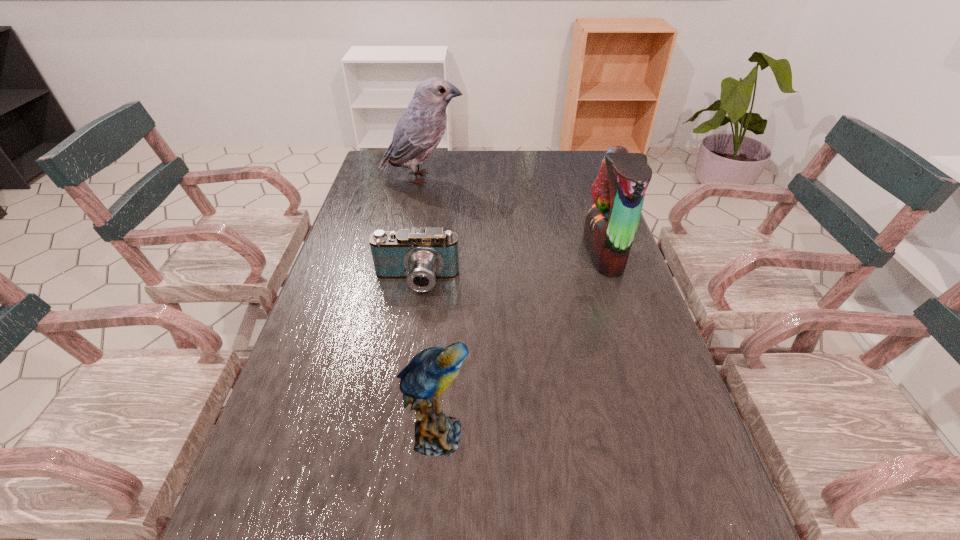
Identify the location of the farthest parrot. (421, 127).

The image size is (960, 540). I want to click on the second farthest parrot, so click(x=618, y=192).

Where is `the rightmost parrot`? the rightmost parrot is located at coordinates (618, 192).

Find the location of a particular element. This screenshot has height=540, width=960. the nearest object is located at coordinates (430, 372).

Where is `camcorder`? Image resolution: width=960 pixels, height=540 pixels. camcorder is located at coordinates (421, 256).

Identify the location of vacant space situated 0.220m on the front-facing side of the farthest object. This screenshot has width=960, height=540. (527, 178).

At what (x,y) coordinates should I click in order to perform the action: click on free region located at the face of the second farthest parrot. Please return your answer as a coordinate pair (x, y). Looking at the image, I should click on (445, 253).

This screenshot has height=540, width=960. What are the coordinates of `vacant space located at the face of the second farthest parrot` in the screenshot? It's located at (561, 253).

The image size is (960, 540). I want to click on free spot located 0.350m at the face of the second farthest parrot, so click(x=463, y=253).

The image size is (960, 540). In order to click on blank space located on the face of the nearest object in this screenshot , I will do `click(607, 435)`.